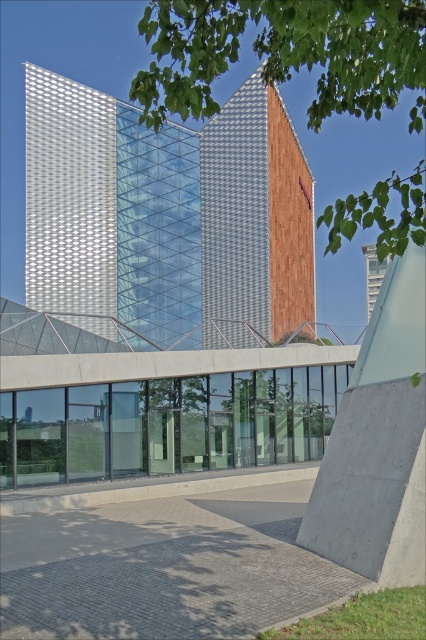
Question: Is green leafy tree at upper center above white glass tower at upper center?

Choices:
 (A) yes
 (B) no

Answer: (A)

Question: Among these objects, which one is nearest to the camera?

Choices:
 (A) white glass tower at upper center
 (B) metallic grid tower at center
 (C) green leafy tree at upper center
 (D) wooden panel at center

Answer: (C)

Question: From the image, what is the correct spatial relationship of green leafy tree at upper center in relation to white glass tower at upper center?

Choices:
 (A) below
 (B) above

Answer: (B)

Question: Does metallic grid tower at center lie behind wooden panel at center?

Choices:
 (A) no
 (B) yes

Answer: (B)

Question: Which point is farther from the camera taking this photo?

Choices:
 (A) (368, 259)
 (B) (227, 224)
 (C) (293, 22)

Answer: (A)

Question: Which point is farther to the camera?

Choices:
 (A) wooden panel at center
 (B) metallic grid tower at center

Answer: (B)